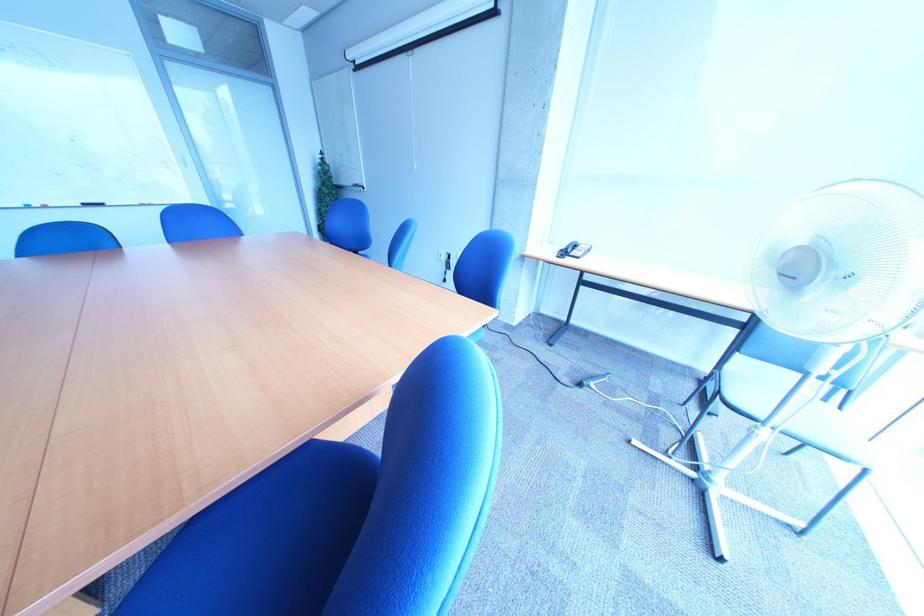
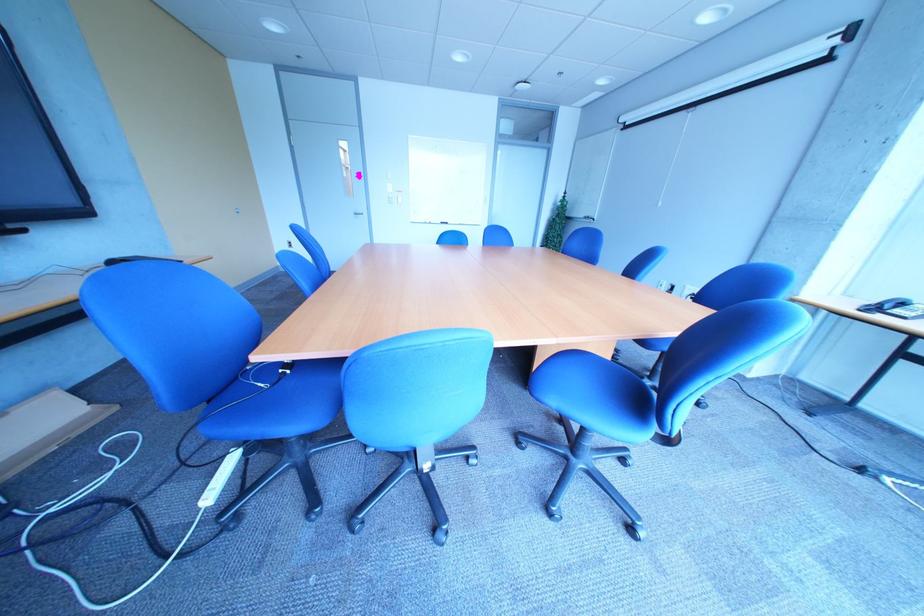
Question: The camera is either moving clockwise (left) or counter-clockwise (right) around the object. The first image is from the beginning of the video and the second image is from the end. Is the camera moving left or right when shooting the video?

Choices:
 (A) Left
 (B) Right

Answer: (B)